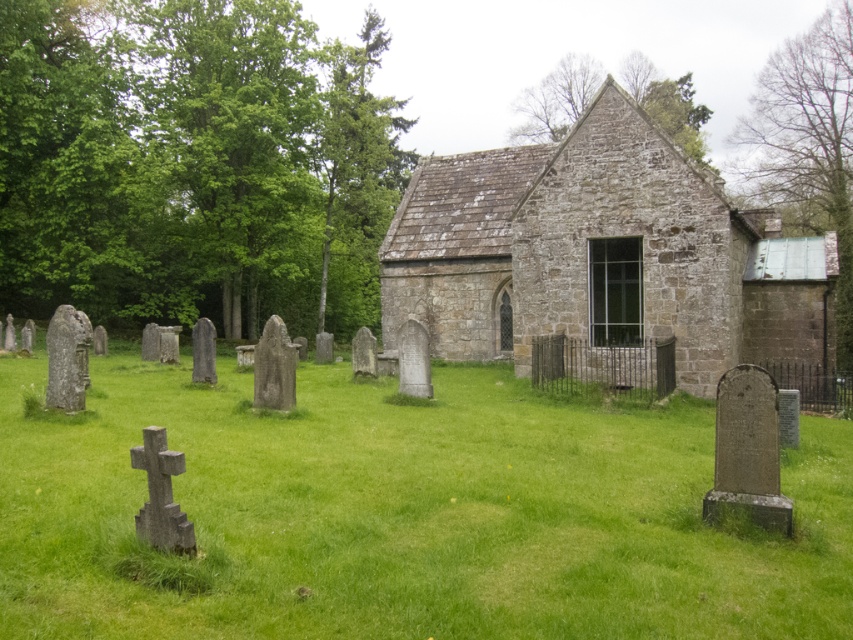
You are a visitor at the cemetery and want to take a photo of the green leafy tree at upper right and the gray stone cross at lower left. Which object is wider?

The green leafy tree at upper right is wider than the gray stone cross at lower left.

You are standing in front of the chapel and notice two trees in the scene. Which tree, the green leafy tree at left or the green textured tree at upper center, is positioned closer to the ground?

The green leafy tree at left is positioned closer to the ground since it is located below the green textured tree at upper center.

You are standing at the entrance of the chapel and notice both the green leafy tree at upper right and the gray stone cross at lower left. Which object is positioned to the right side of the other?

The green leafy tree at upper right is positioned to the right of the gray stone cross at lower left.